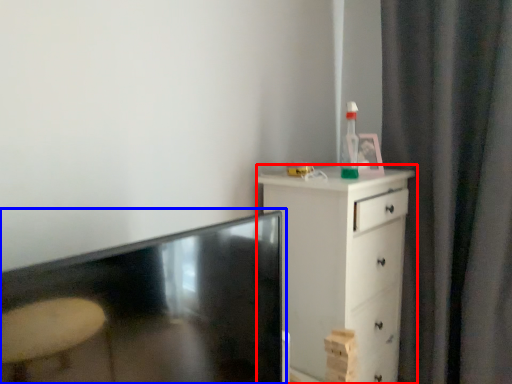
Question: Among these objects, which one is nearest to the camera, chest of drawers (highlighted by a red box) or table (highlighted by a blue box)?

Choices:
 (A) chest of drawers
 (B) table

Answer: (B)